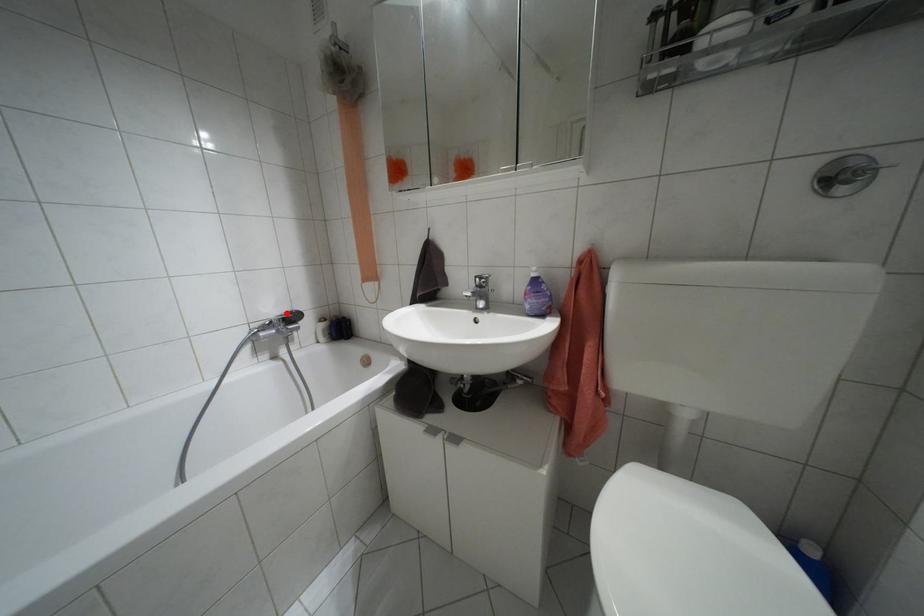
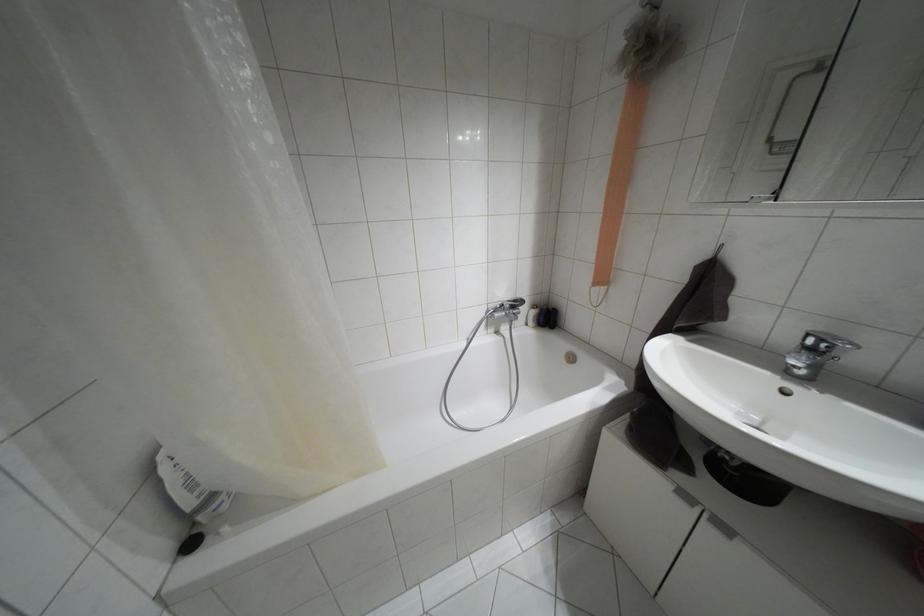
Locate, in the second image, the point that corresponds to the highlighted location in the first image.

(514, 301)